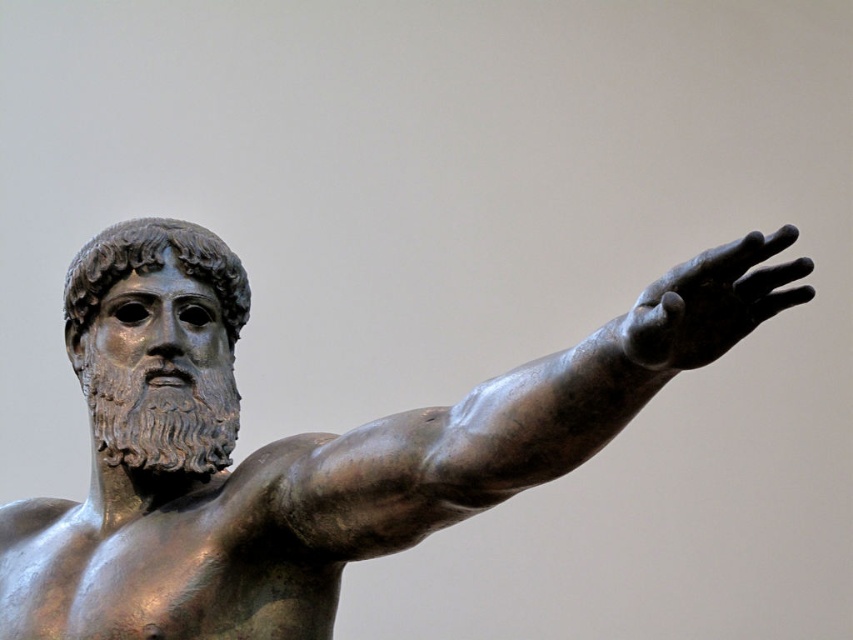
Which is below, shiny bronze statue at center or bronze hand at upper right?

Positioned lower is shiny bronze statue at center.

Who is positioned more to the right, shiny bronze statue at center or bronze hand at upper right?

Positioned to the right is bronze hand at upper right.

Is point (489, 467) closer to viewer compared to point (729, 340)?

No, it is behind (729, 340).

In order to click on shiny bronze statue at center in this screenshot , I will do `click(308, 444)`.